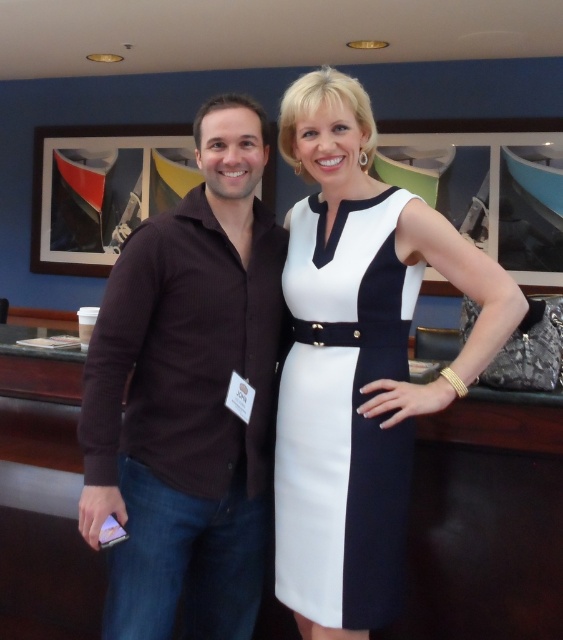
Question: Which of these objects is positioned farthest from the brown ribbed sweater at center?

Choices:
 (A) white smooth dress at center
 (B) white leather dress at center

Answer: (B)

Question: Can you confirm if white leather dress at center is positioned to the right of white smooth dress at center?

Choices:
 (A) no
 (B) yes

Answer: (B)

Question: Is brown ribbed sweater at center bigger than white smooth dress at center?

Choices:
 (A) yes
 (B) no

Answer: (A)

Question: Which object appears closest to the camera in this image?

Choices:
 (A) brown ribbed sweater at center
 (B) white leather dress at center

Answer: (A)

Question: Is the position of brown ribbed sweater at center less distant than that of white smooth dress at center?

Choices:
 (A) yes
 (B) no

Answer: (A)

Question: Which object is the farthest from the white smooth dress at center?

Choices:
 (A) white leather dress at center
 (B) brown ribbed sweater at center

Answer: (B)